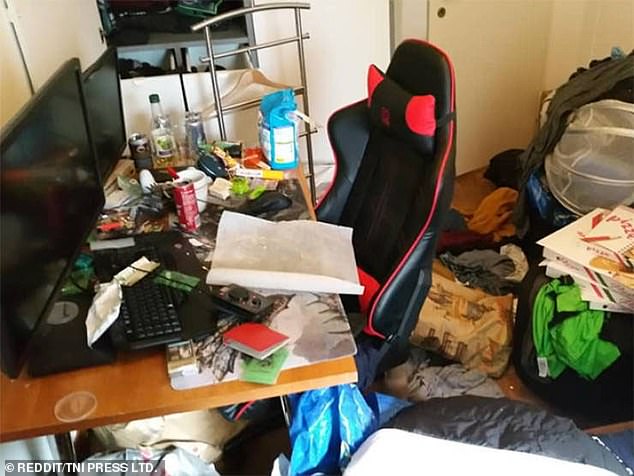
In order to click on keyboard in this screenshot , I will do `click(155, 322)`.